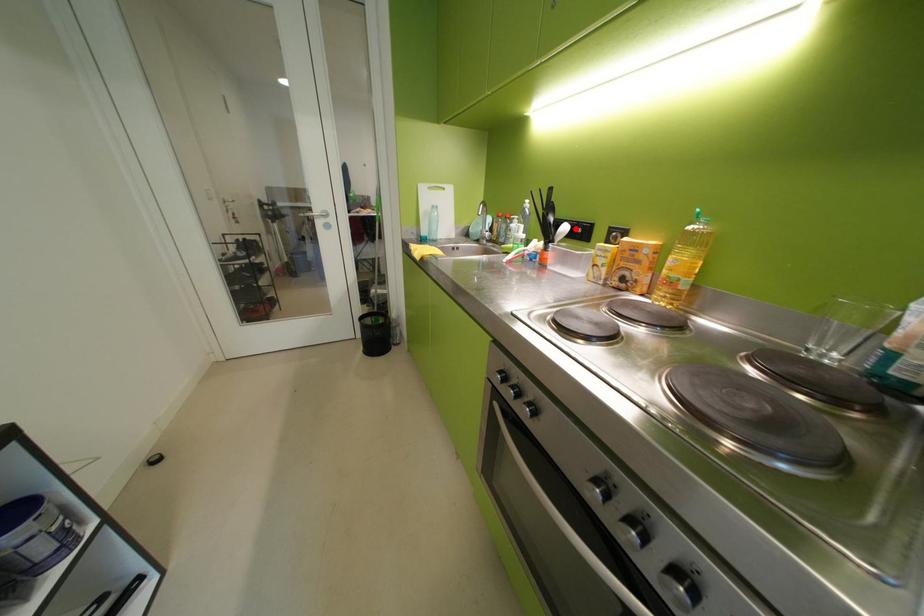
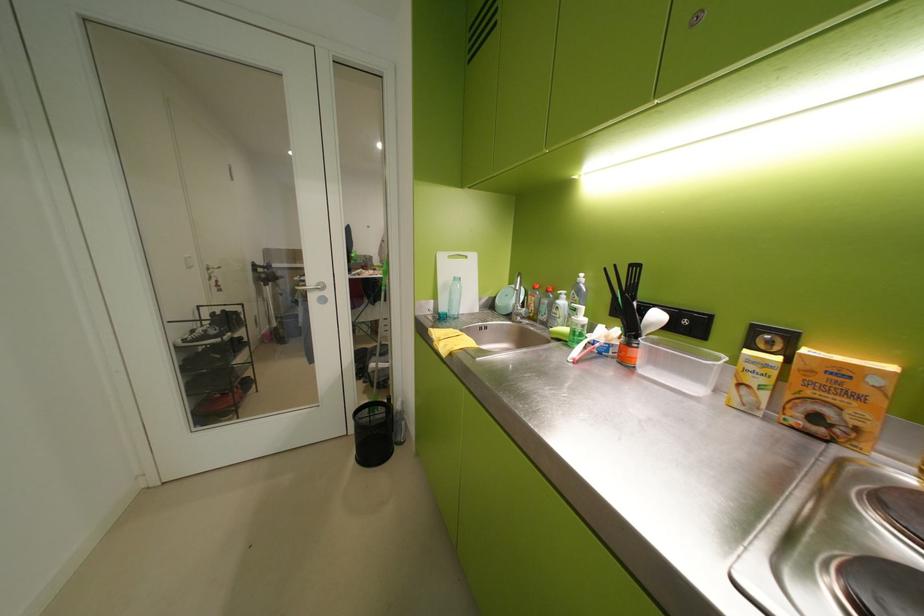
Locate, in the second image, the point that corresponds to the highlighted location in the first image.

(667, 317)